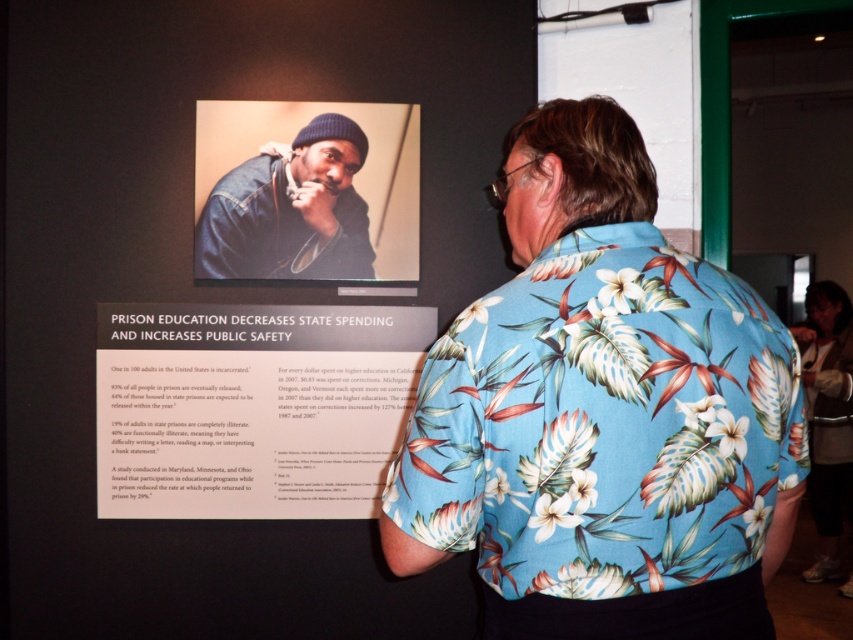
Question: Does blue floral print shirt at upper center lie in front of floral print shirt at center?

Choices:
 (A) yes
 (B) no

Answer: (A)

Question: Does blue floral print shirt at upper center come behind denim jacket at upper center?

Choices:
 (A) yes
 (B) no

Answer: (B)

Question: Does blue floral print shirt at upper center lie in front of matte paper poster at center?

Choices:
 (A) yes
 (B) no

Answer: (A)

Question: Which point appears closest to the camera in this image?

Choices:
 (A) (828, 284)
 (B) (265, 368)

Answer: (B)

Question: Which object appears closest to the camera in this image?

Choices:
 (A) matte paper poster at center
 (B) blue floral print shirt at upper center
 (C) floral print shirt at center

Answer: (B)

Question: Which point is farther to the camera?

Choices:
 (A) denim jacket at upper center
 (B) blue floral print shirt at upper center

Answer: (A)